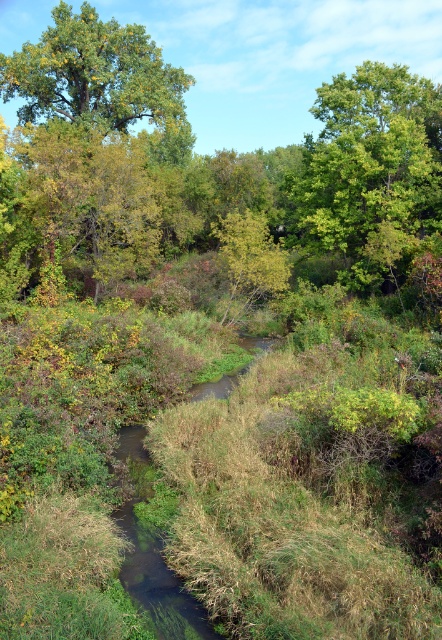
Question: Does green leafy tree at upper right have a lesser width compared to green leafy tree at upper left?

Choices:
 (A) yes
 (B) no

Answer: (A)

Question: Which object is farther from the camera taking this photo?

Choices:
 (A) green leafy tree at upper right
 (B) green leafy tree at upper left

Answer: (B)

Question: Does green leafy tree at upper left have a lesser width compared to green leafy tree at center?

Choices:
 (A) no
 (B) yes

Answer: (A)

Question: Can you confirm if green leafy tree at upper left is bigger than green leafy tree at center?

Choices:
 (A) no
 (B) yes

Answer: (B)

Question: Which of the following is the closest to the observer?

Choices:
 (A) green leafy tree at upper left
 (B) green leafy tree at upper right
 (C) green leafy tree at center

Answer: (B)

Question: Which object appears closest to the camera in this image?

Choices:
 (A) green leafy tree at center
 (B) green leafy tree at upper left

Answer: (A)